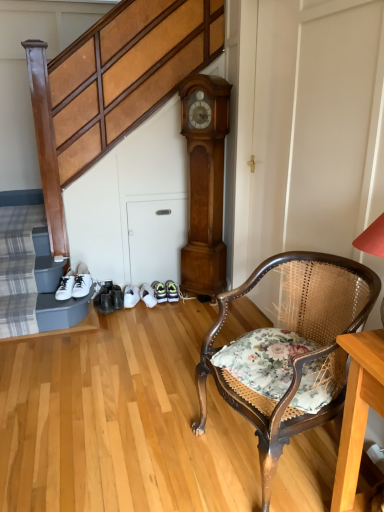
I want to click on blank area beneath floral fabric chair at lower right (from a real-world perspective), so click(x=279, y=458).